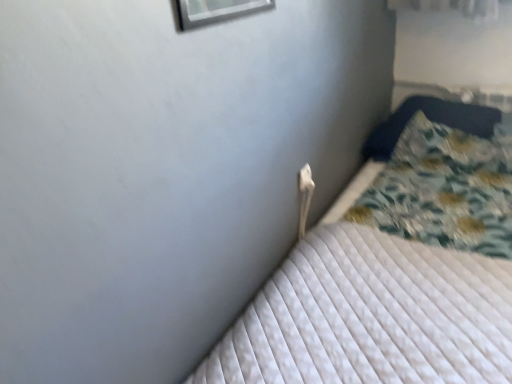
Question: Does white plastic electric outlet at upper center appear on the right side of white quilted mattress at center?

Choices:
 (A) no
 (B) yes

Answer: (A)

Question: From a real-world perspective, is white plastic electric outlet at upper center positioned under white quilted mattress at center based on gravity?

Choices:
 (A) yes
 (B) no

Answer: (B)

Question: Is white plastic electric outlet at upper center shorter than white quilted mattress at center?

Choices:
 (A) yes
 (B) no

Answer: (A)

Question: Is white plastic electric outlet at upper center turned away from white quilted mattress at center?

Choices:
 (A) no
 (B) yes

Answer: (A)

Question: Does white plastic electric outlet at upper center appear on the left side of white quilted mattress at center?

Choices:
 (A) no
 (B) yes

Answer: (B)

Question: Considering the positions of white plastic electric outlet at upper center and fluffy blue pillow at right in the image, is white plastic electric outlet at upper center wider or thinner than fluffy blue pillow at right?

Choices:
 (A) thin
 (B) wide

Answer: (A)

Question: Is white plastic electric outlet at upper center bigger or smaller than fluffy blue pillow at right?

Choices:
 (A) small
 (B) big

Answer: (A)

Question: Considering the positions of point (302, 180) and point (457, 125), is point (302, 180) closer or farther from the camera than point (457, 125)?

Choices:
 (A) closer
 (B) farther

Answer: (A)

Question: Is white plastic electric outlet at upper center in front of or behind fluffy blue pillow at right in the image?

Choices:
 (A) behind
 (B) front

Answer: (B)

Question: Is fluffy blue pillow at right to the left or to the right of white quilted mattress at center in the image?

Choices:
 (A) right
 (B) left

Answer: (A)

Question: Considering the positions of point [x=394, y=127] and point [x=433, y=165], is point [x=394, y=127] closer or farther from the camera than point [x=433, y=165]?

Choices:
 (A) farther
 (B) closer

Answer: (A)

Question: From the image's perspective, is fluffy blue pillow at right above or below white quilted mattress at center?

Choices:
 (A) above
 (B) below

Answer: (A)

Question: Is fluffy blue pillow at right wider or thinner than white quilted mattress at center?

Choices:
 (A) wide
 (B) thin

Answer: (B)

Question: Based on their sizes in the image, would you say fluffy blue pillow at right is bigger or smaller than white plastic electric outlet at upper center?

Choices:
 (A) big
 (B) small

Answer: (A)

Question: In the image, is fluffy blue pillow at right positioned in front of or behind white plastic electric outlet at upper center?

Choices:
 (A) front
 (B) behind

Answer: (B)